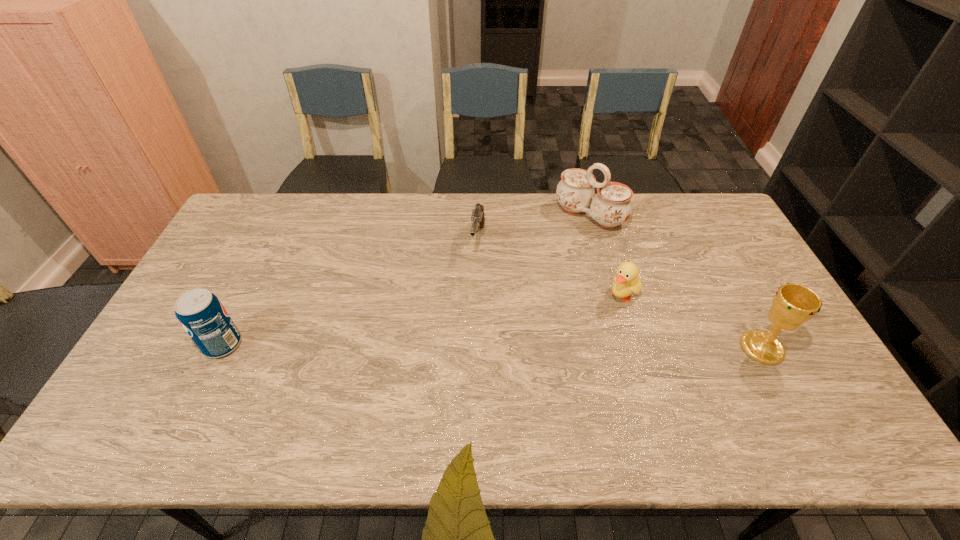
Where is `pop`? This screenshot has width=960, height=540. pop is located at coordinates (202, 315).

Identify the location of the third tallest object. This screenshot has width=960, height=540. (202, 315).

Image resolution: width=960 pixels, height=540 pixels. What are the coordinates of `chalice` in the screenshot? It's located at (793, 304).

Where is `duckling`? duckling is located at coordinates (626, 281).

This screenshot has height=540, width=960. What are the coordinates of `chinaware` in the screenshot? It's located at (611, 206).

Find the location of `the second object from left to right`. the second object from left to right is located at coordinates (477, 217).

The image size is (960, 540). I want to click on free spot located 0.060m on the front of the third shortest object, so click(205, 380).

You are a GUI agent. You are given a task and a screenshot of the screen. Output one action in this format:
    pyautogui.click(x=<x>, y=<y>)
    Task: Click on the vacant space situated 0.170m on the back of the rightmost object
    Image resolution: width=960 pixels, height=540 pixels.
    Given the screenshot: What is the action you would take?
    pyautogui.click(x=730, y=287)

Where is `free point located on the front-facing side of the third nearest object`? The image size is (960, 540). free point located on the front-facing side of the third nearest object is located at coordinates (562, 355).

This screenshot has height=540, width=960. What are the coordinates of `vacant area situated on the front-facing side of the third nearest object` in the screenshot? It's located at (579, 338).